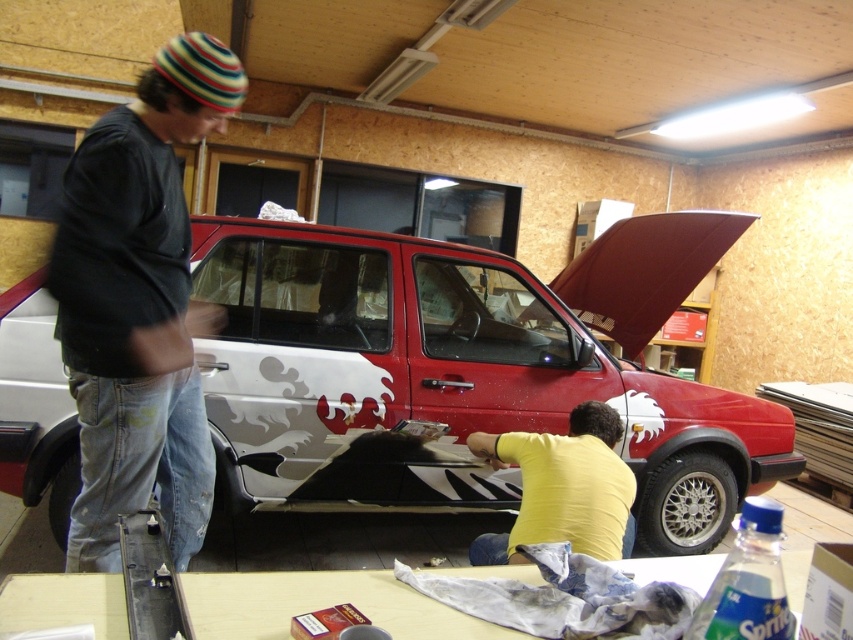
Question: Which point is farther to the camera?

Choices:
 (A) striped knit cap at upper left
 (B) yellow matte shirt at lower center
 (C) red matte car at center

Answer: (C)

Question: Can you confirm if red matte car at center is positioned above yellow matte shirt at lower center?

Choices:
 (A) yes
 (B) no

Answer: (A)

Question: Does red matte car at center come behind yellow matte shirt at lower center?

Choices:
 (A) yes
 (B) no

Answer: (A)

Question: Does red matte car at center appear on the right side of yellow matte shirt at lower center?

Choices:
 (A) no
 (B) yes

Answer: (B)

Question: Which of these objects is positioned closest to the yellow matte shirt at lower center?

Choices:
 (A) red matte car at center
 (B) striped knit cap at upper left

Answer: (A)

Question: Considering the real-world distances, which object is farthest from the red matte car at center?

Choices:
 (A) striped knit cap at upper left
 (B) yellow matte shirt at lower center

Answer: (A)